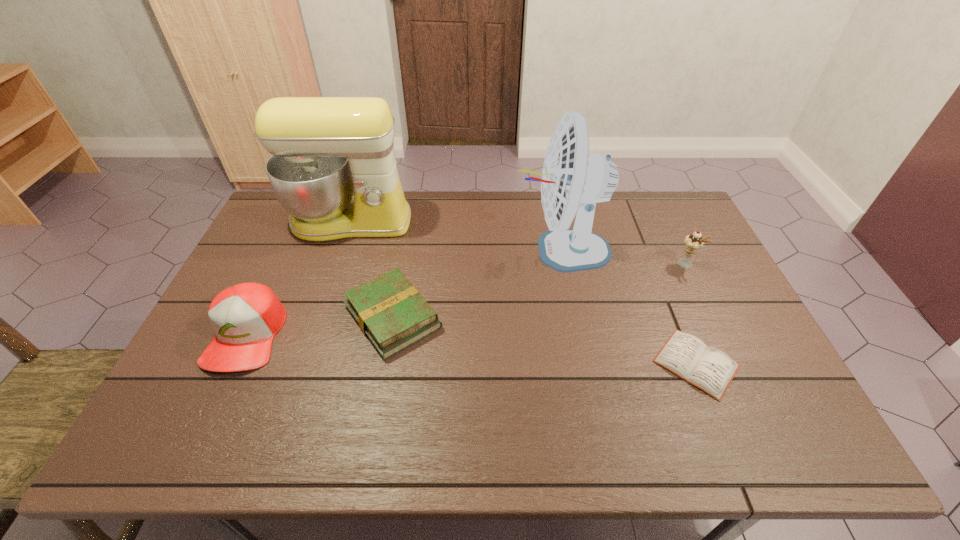
I want to click on fan, so click(x=573, y=180).

Where is `mixer`? mixer is located at coordinates (324, 149).

At what (x,y) coordinates should I click in order to perform the action: click on icecream. Please return your answer as a coordinate pair (x, y). The width and height of the screenshot is (960, 540). Looking at the image, I should click on point(694,242).

Image resolution: width=960 pixels, height=540 pixels. I want to click on baseball cap, so click(x=245, y=317).

Find the location of a particular element. This screenshot has height=540, width=960. the fifth tallest object is located at coordinates (392, 314).

Where is `the shortest object`? The image size is (960, 540). the shortest object is located at coordinates (709, 369).

In order to click on free space located 0.210m on the grille of the third object from right to left in this screenshot , I will do tap(447, 251).

Image resolution: width=960 pixels, height=540 pixels. What are the coordinates of `free region located 0.200m on the grille of the third object from right to left` in the screenshot? It's located at (450, 251).

Locate an element on the screen. Image resolution: width=960 pixels, height=540 pixels. vacant region located on the grille of the third object from right to left is located at coordinates (478, 251).

At what (x,y) coordinates should I click in order to perform the action: click on vacant space located on the side of the mixer with the control knob. Please return your answer as a coordinate pair (x, y). The width and height of the screenshot is (960, 540). Looking at the image, I should click on (314, 329).